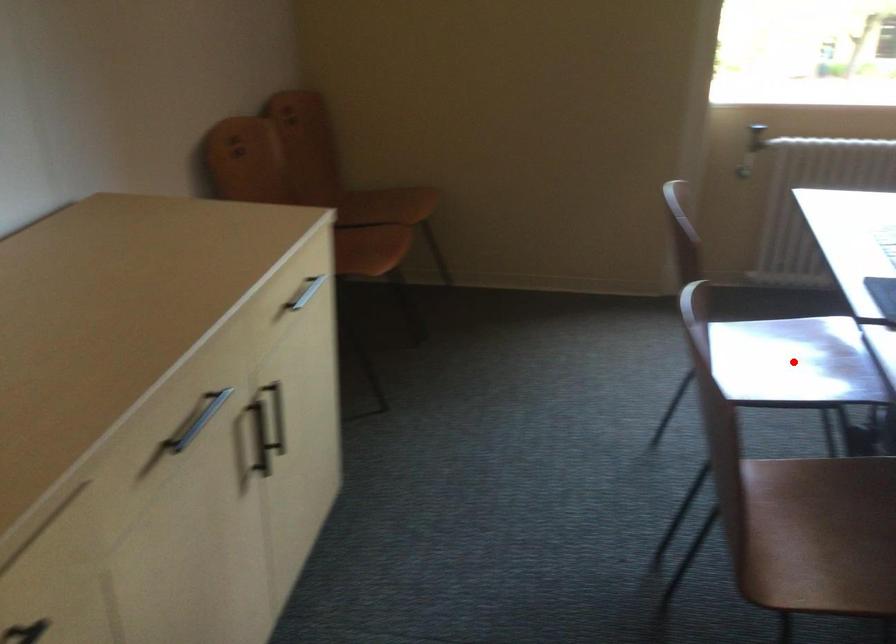
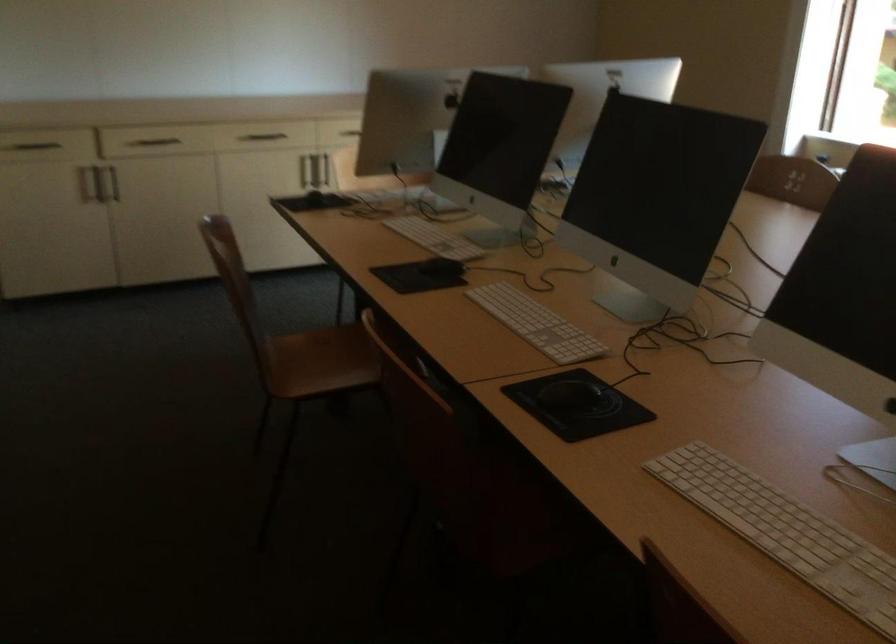
Question: I am providing you with two images of the same scene from different viewpoints. A red point is marked on the first image. At the location where the point appears in image 1, is it still visible in image 2?

Choices:
 (A) Yes
 (B) No

Answer: (B)